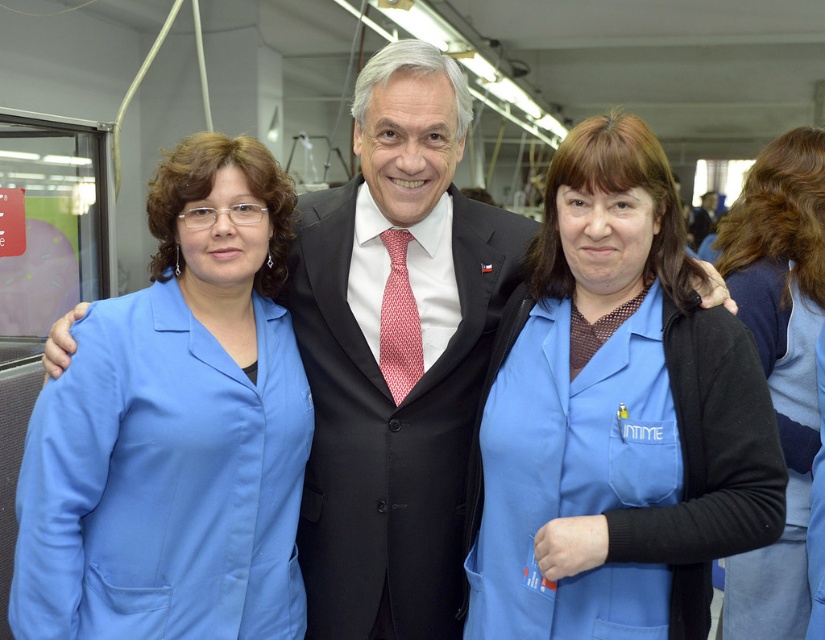
Which of these two, black satin suit at center or blue fabric shirt at right, stands taller?

blue fabric shirt at right

How distant is black satin suit at center from blue fabric shirt at right?

black satin suit at center and blue fabric shirt at right are 34.98 inches apart.

What do you see at coordinates (390, 428) in the screenshot?
I see `black satin suit at center` at bounding box center [390, 428].

You are a GUI agent. You are given a task and a screenshot of the screen. Output one action in this format:
    pyautogui.click(x=<x>, y=<y>)
    Task: Click on the black satin suit at center
    The image size is (825, 640).
    Given the screenshot: What is the action you would take?
    pyautogui.click(x=390, y=428)

Between blue fabric uniform at center and matte blue lab coat at left, which one appears on the left side from the viewer's perspective?

From the viewer's perspective, matte blue lab coat at left appears more on the left side.

Between blue fabric uniform at center and matte blue lab coat at left, which one is positioned higher?

Positioned higher is matte blue lab coat at left.

Is point (701, 340) closer to camera compared to point (236, 348)?

That is True.

You are a GUI agent. You are given a task and a screenshot of the screen. Output one action in this format:
    pyautogui.click(x=<x>, y=<y>)
    Task: Click on the blue fabric uniform at center
    
    Given the screenshot: What is the action you would take?
    pyautogui.click(x=615, y=416)

Does blue fabric uniform at center appear under black satin suit at center?

No.

Is point (498, 449) positioned behind point (369, 484)?

No.

Locate an element on the screen. blue fabric uniform at center is located at coordinates (615, 416).